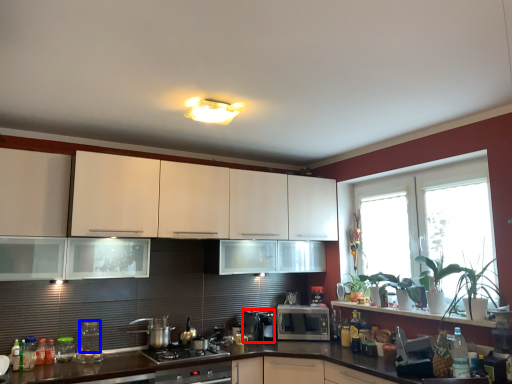
Question: Among these objects, which one is nearest to the camera, appliance (highlighted by a red box) or appliance (highlighted by a blue box)?

Choices:
 (A) appliance
 (B) appliance

Answer: (B)